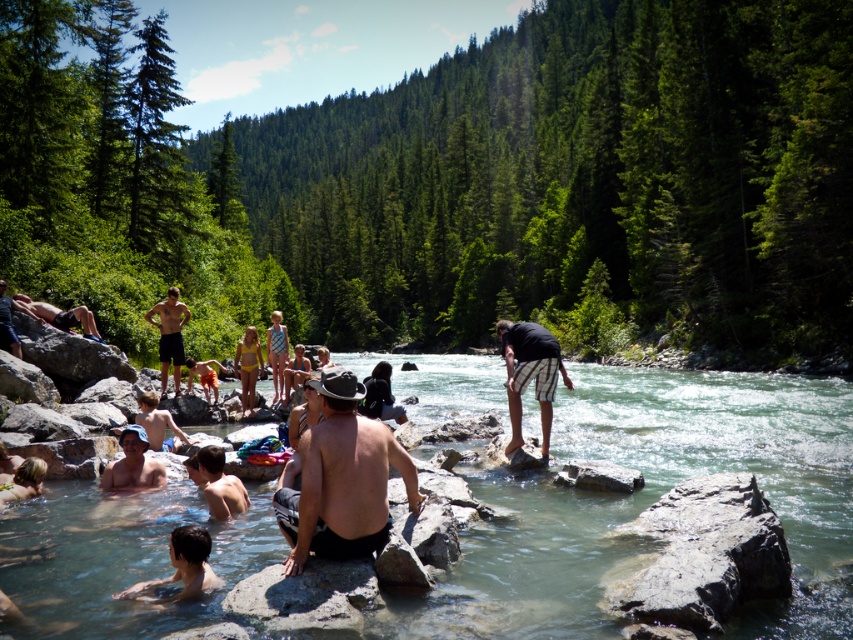
Which is more to the right, light brown skin at center or smooth skin man at left?

light brown skin at center is more to the right.

Consider the image. Does light brown skin at center have a lesser width compared to smooth skin man at left?

Yes, light brown skin at center is thinner than smooth skin man at left.

Who is more distant from viewer, (142, 417) or (4, 317)?

Positioned behind is point (4, 317).

Locate an element on the screen. This screenshot has width=853, height=640. light brown skin at center is located at coordinates (158, 424).

Does point (137, 589) lie in front of point (173, 448)?

That is True.

Between smooth skin man at lower left and light brown skin at center, which one has less height?

With less height is smooth skin man at lower left.

This screenshot has width=853, height=640. What do you see at coordinates (183, 564) in the screenshot?
I see `smooth skin man at lower left` at bounding box center [183, 564].

In order to click on smooth skin man at lower left in this screenshot , I will do `click(183, 564)`.

Does shiny metallic hat at center have a lesser height compared to smooth skin man at lower left?

No.

Which is in front, point (366, 481) or point (192, 556)?

Point (192, 556) is in front.

Identify the location of shiny metallic hat at center. The height and width of the screenshot is (640, 853). (341, 480).